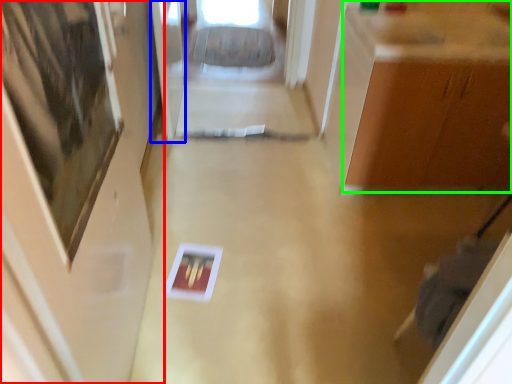
Question: Which object is the closest to the door (highlighted by a red box)? Choose among these: glass door (highlighted by a blue box) or cabinetry (highlighted by a green box).

Choices:
 (A) glass door
 (B) cabinetry

Answer: (A)